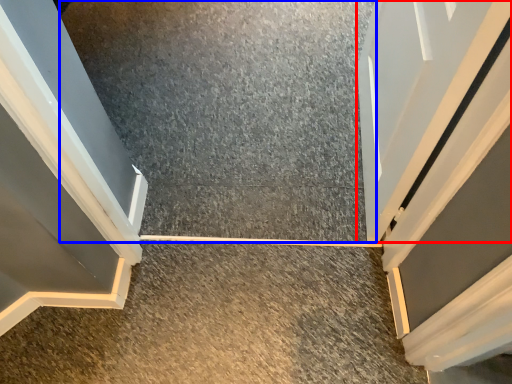
Question: Which object is further to the camera taking this photo, door (highlighted by a red box) or concrete (highlighted by a blue box)?

Choices:
 (A) door
 (B) concrete

Answer: (B)